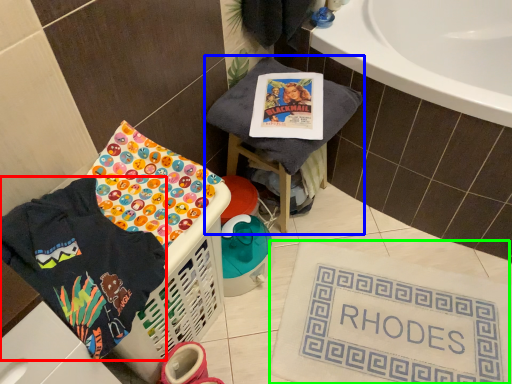
Question: Which object is the farthest from clothing (highlighted by a red box)? Choose among these: furniture (highlighted by a blue box) or bath mat (highlighted by a green box).

Choices:
 (A) furniture
 (B) bath mat

Answer: (B)